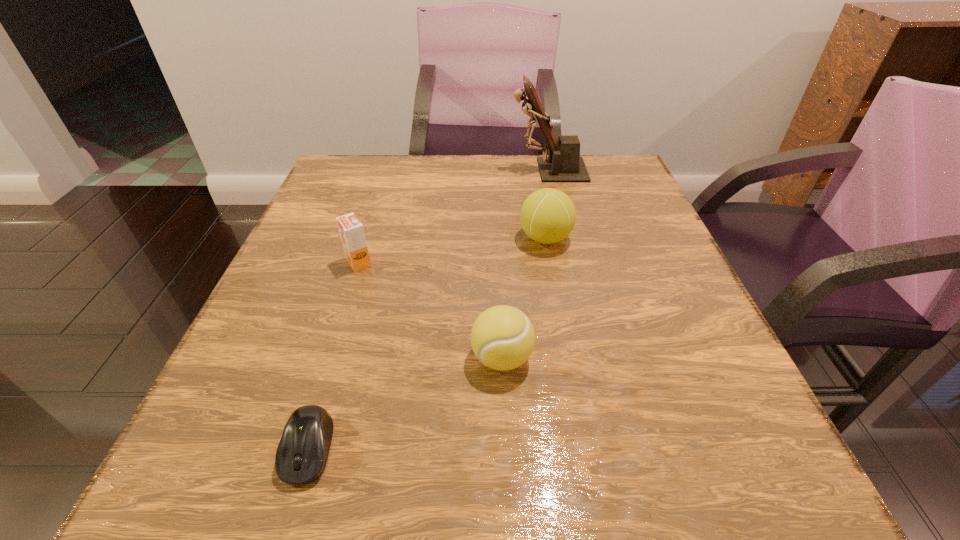
Locate an element on the screen. This screenshot has height=540, width=960. free space that satisfies the following two spatial constraints: 1. on the back side of the shortest object; 2. on the right side of the fourth farthest object is located at coordinates (336, 358).